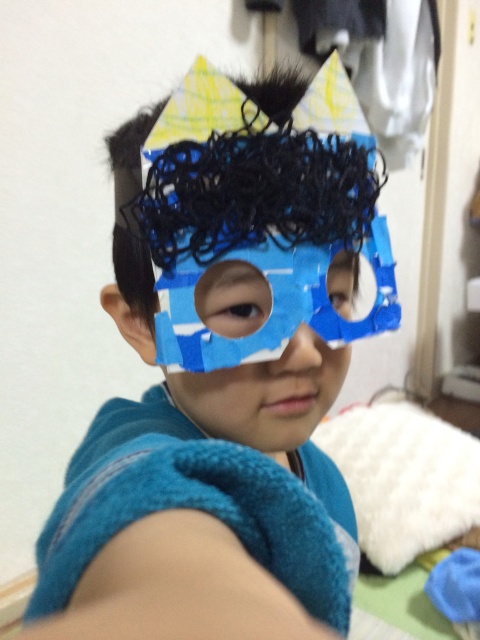
Question: Can you confirm if blue paper mask at center is positioned below brown matte eye at center?

Choices:
 (A) yes
 (B) no

Answer: (A)

Question: Which of these objects is positioned closest to the blue cardboard mask at center?

Choices:
 (A) brown matte eye at center
 (B) blue paper mask at center

Answer: (B)

Question: Which object is positioned closest to the brown matte eye at center?

Choices:
 (A) blue cardboard mask at center
 (B) blue paper mask at center
 (C) blue matte eye at center

Answer: (B)

Question: Can you confirm if blue paper mask at center is positioned to the right of brown matte eye at center?

Choices:
 (A) yes
 (B) no

Answer: (A)

Question: Is blue cardboard mask at center thinner than blue paper mask at center?

Choices:
 (A) no
 (B) yes

Answer: (A)

Question: Which object appears farthest from the camera in this image?

Choices:
 (A) blue paper mask at center
 (B) blue cardboard mask at center
 (C) brown matte eye at center
 (D) blue matte eye at center

Answer: (D)